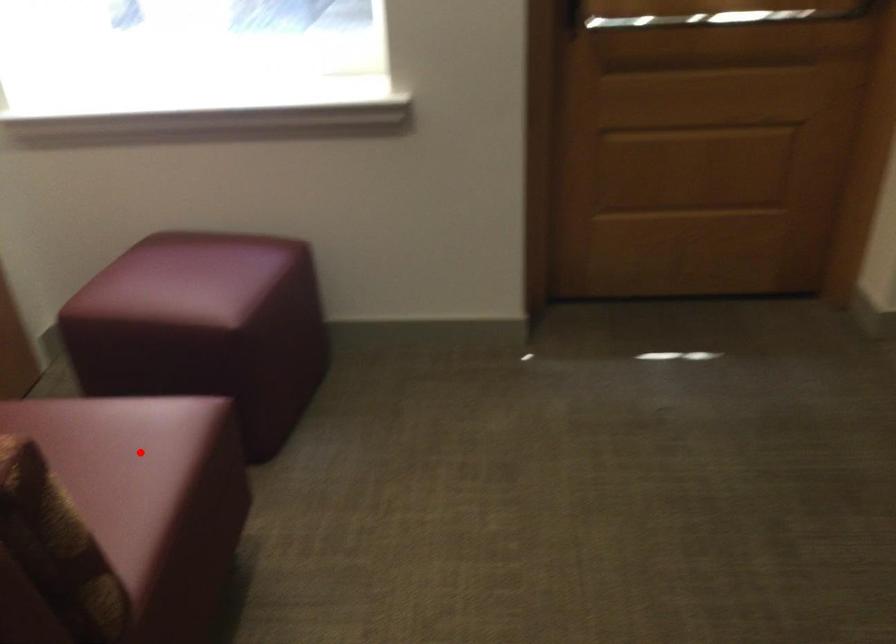
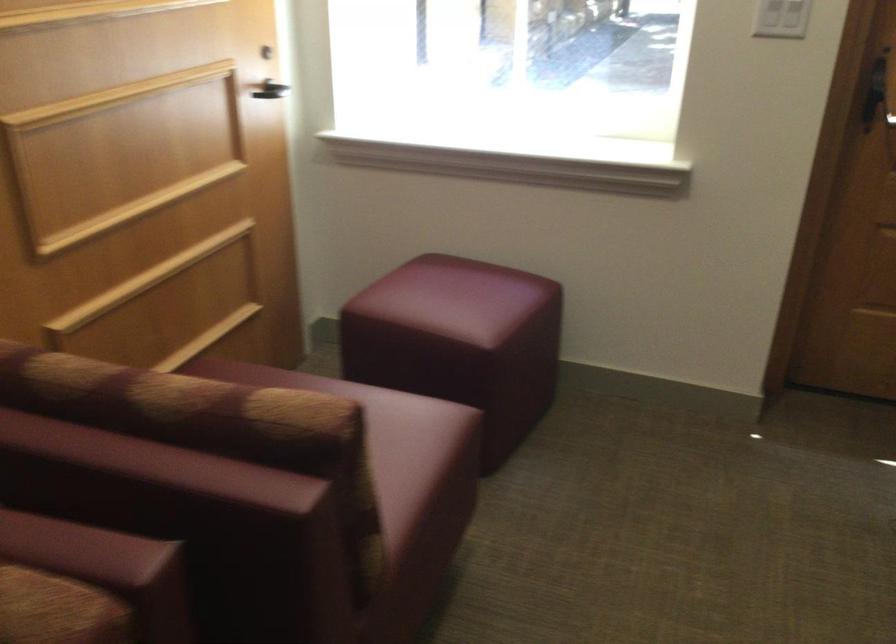
In the second image, find the point that corresponds to the highlighted location in the first image.

(392, 444)